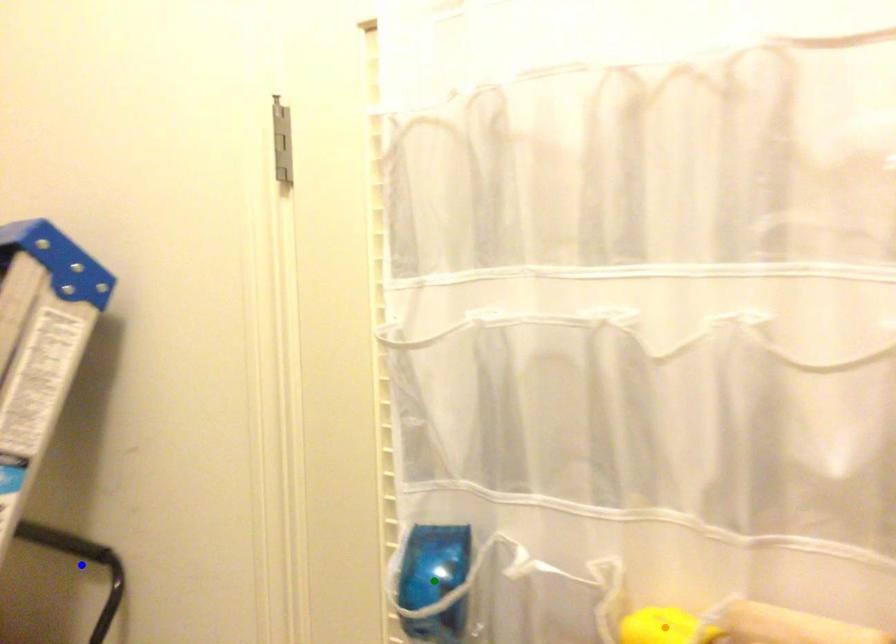
Order these from nearest to farthest:
green point, orange point, blue point

orange point
green point
blue point